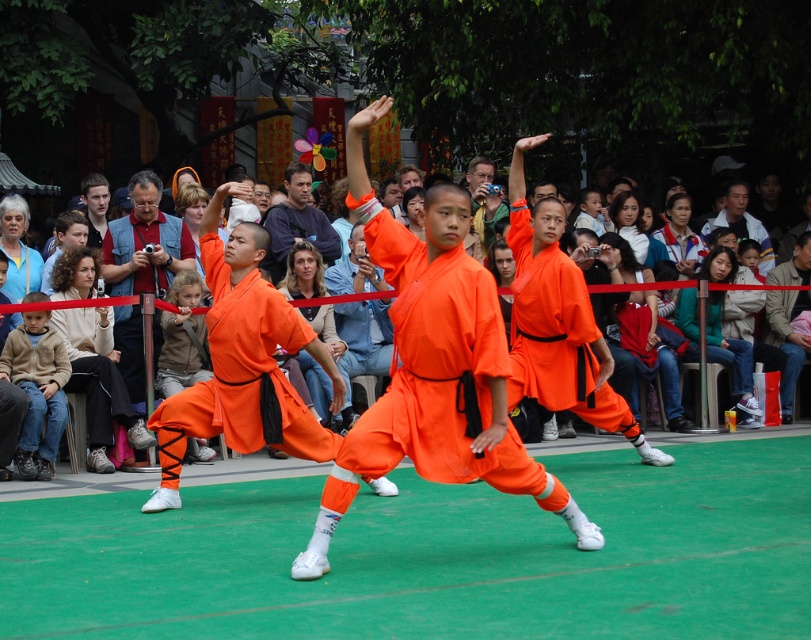
You are standing at the point with coordinates point (432, 368) in the image. What object are you currently standing on?

The point (432, 368) is on the orange cotton robe at center.

You are organizing a photo shoot and need to place a camera stand between the brown fleece jacket at lower left and the matte orange robe at center. Given that the camera stand requires 1 meter of space, can it fit between them?

The brown fleece jacket at lower left has a lesser width compared to matte orange robe at center. Since the camera stand requires 1 meter of space, it depends on the actual distance between them. However, the description only provides information about their widths, not the distance between them. Therefore, we cannot determine if the camera stand will fit based on the given information.

You are a photographer standing behind the performers. You need to capture a photo that includes both the orange cotton robe at center and the brown fleece jacket at lower left. Which object will appear wider in the photo?

The orange cotton robe at center will appear wider in the photo because its width surpasses that of the brown fleece jacket at lower left.